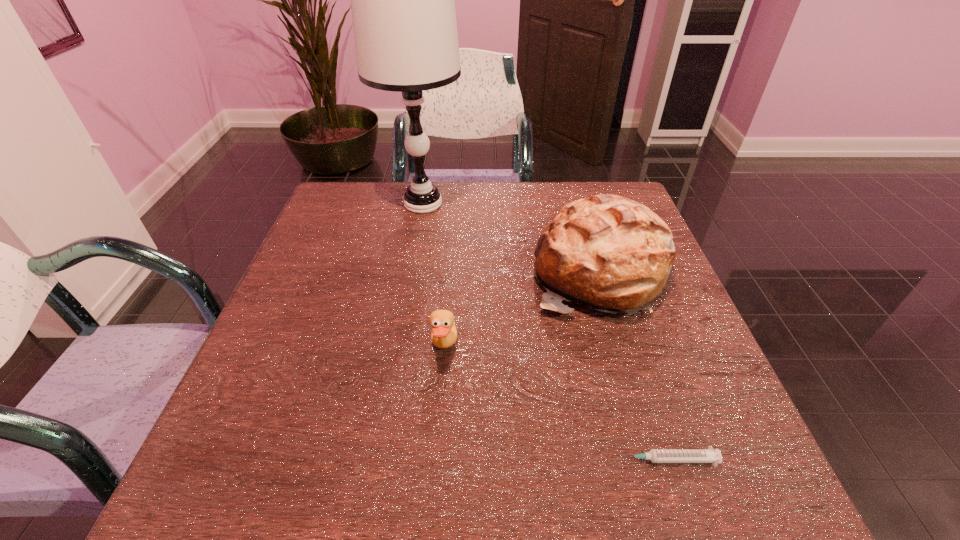
Locate an element on the screen. object at the near right corner is located at coordinates (709, 455).

Locate an element on the screen. The image size is (960, 540). free region at the far edge of the desktop is located at coordinates (402, 185).

Where is `vacant space at the near edge of the desktop`? vacant space at the near edge of the desktop is located at coordinates (658, 500).

Locate an element on the screen. free space at the left edge of the desktop is located at coordinates (340, 268).

At what (x,y) coordinates should I click in order to perform the action: click on free space at the right edge. Please return your answer as a coordinate pair (x, y). Looking at the image, I should click on (694, 417).

This screenshot has height=540, width=960. In order to click on blank space at the near left corner of the desktop in this screenshot , I will do `click(288, 507)`.

Image resolution: width=960 pixels, height=540 pixels. Find the location of `free space between the bread and the duck`. free space between the bread and the duck is located at coordinates (522, 310).

Locate an element on the screen. The width and height of the screenshot is (960, 540). vacant region between the duck and the shortest object is located at coordinates (555, 404).

This screenshot has height=540, width=960. Identify the location of vacant point located between the table lamp and the second shortest object. (434, 276).

What are the coordinates of `free space that is in between the farthest object and the nearest object` in the screenshot? It's located at (544, 332).